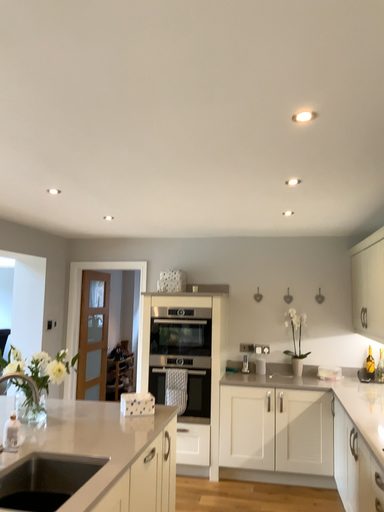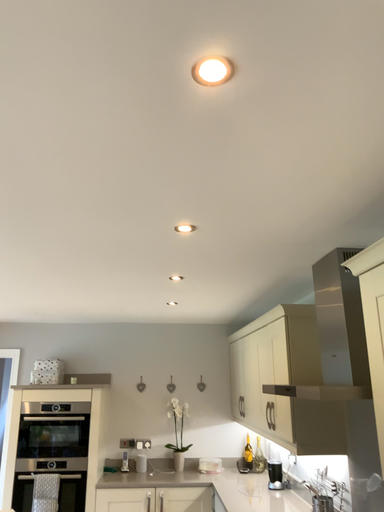
Question: How did the camera likely rotate when shooting the video?

Choices:
 (A) rotated right
 (B) rotated left

Answer: (A)